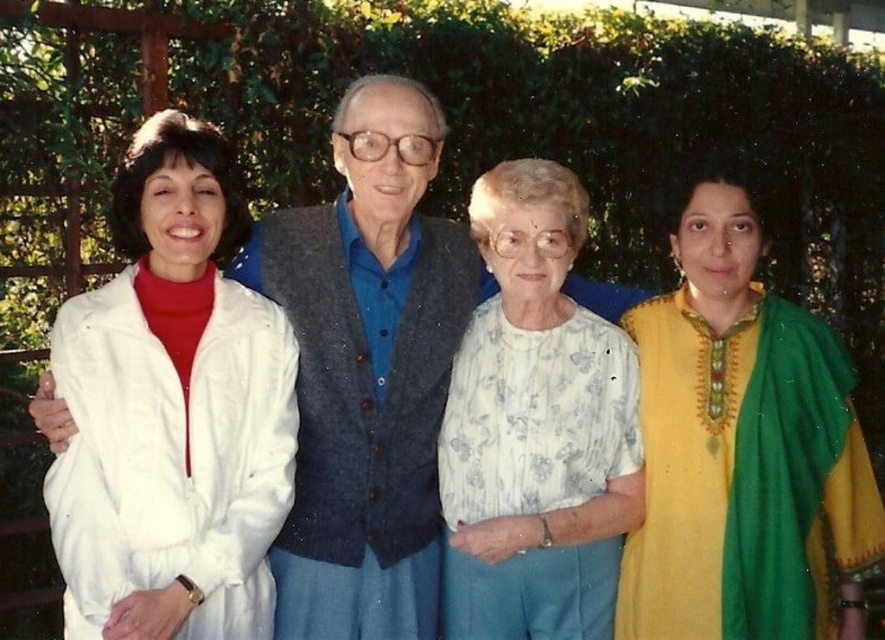
You are a photographer trying to capture a group photo where the white textured blouse at center and the floral cotton blouse at center are both visible. Since you want to ensure both blouses are fully in frame, which blouse should you focus on to avoid cropping the other?

The white textured blouse at center is taller than the floral cotton blouse at center, so focusing on the white textured blouse at center would ensure the shorter floral cotton blouse at center remains in frame without being cropped.